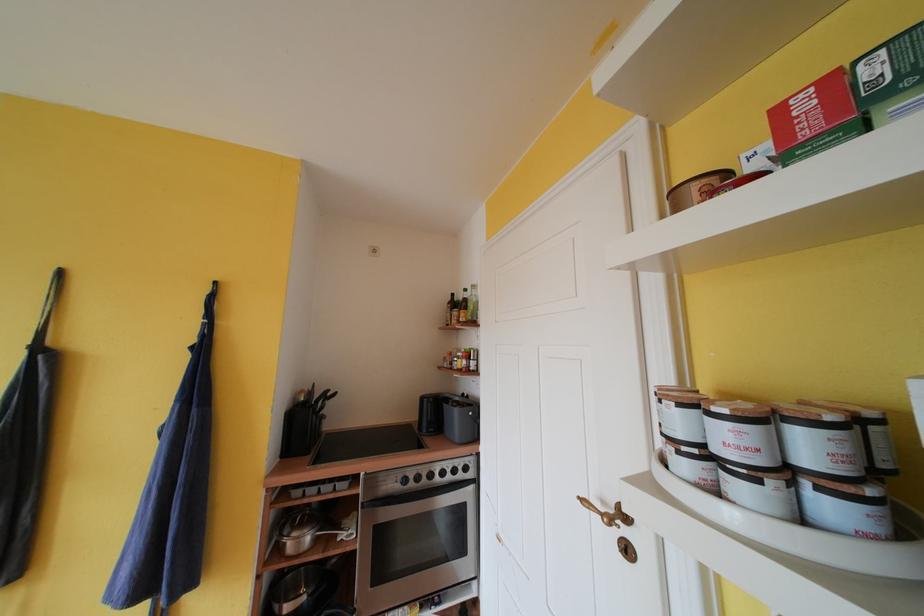
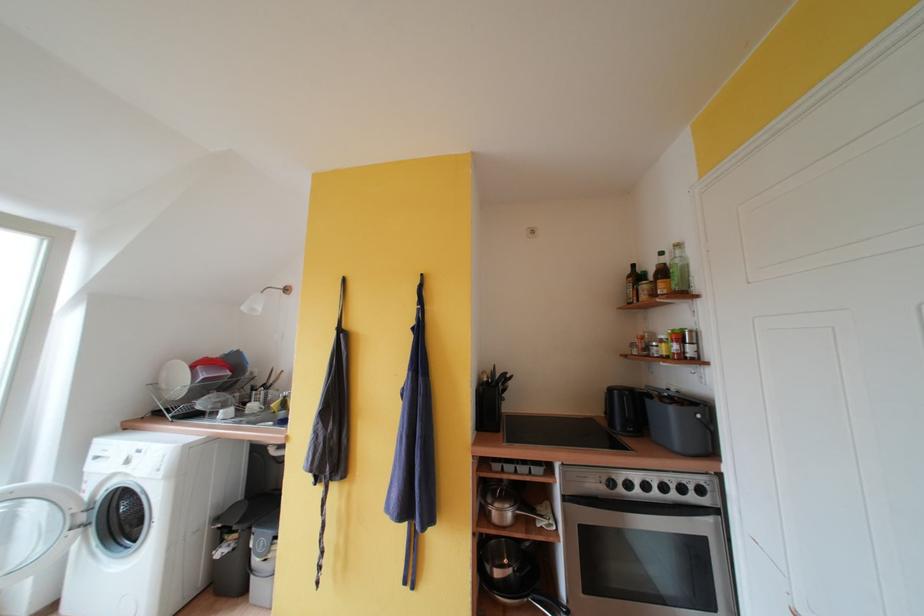
In the second image, find the point that corresponds to (x=407, y=487) in the first image.

(614, 490)